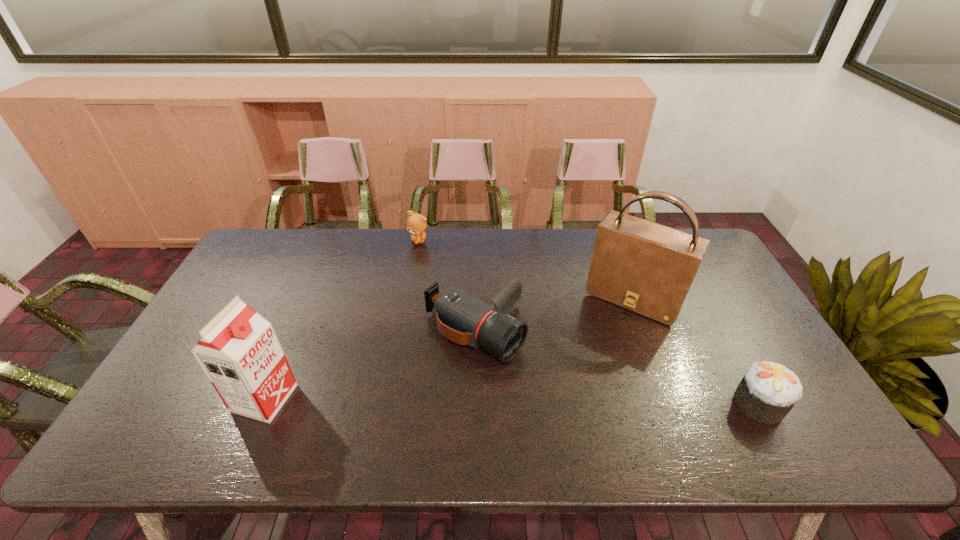
Locate which object is the fourth closest to the second object from right to left. Please provide its 2D coordinates. Your answer should be formatted as a tuple, i.e. [(x, y)], where the tuple contains the x and y coordinates of a point satisfying the conditions above.

[(239, 352)]

Where is `object that is the third closest to the rightmost object`? The image size is (960, 540). object that is the third closest to the rightmost object is located at coordinates (416, 224).

The image size is (960, 540). I want to click on free space that satisfies the following two spatial constraints: 1. on the back side of the tallest object; 2. on the right side of the third object from right to left, so click(475, 297).

Where is `free spot that satisfies the following two spatial constraints: 1. on the front side of the cupcake; 2. on the left side of the soya milk`? This screenshot has width=960, height=540. free spot that satisfies the following two spatial constraints: 1. on the front side of the cupcake; 2. on the left side of the soya milk is located at coordinates (262, 404).